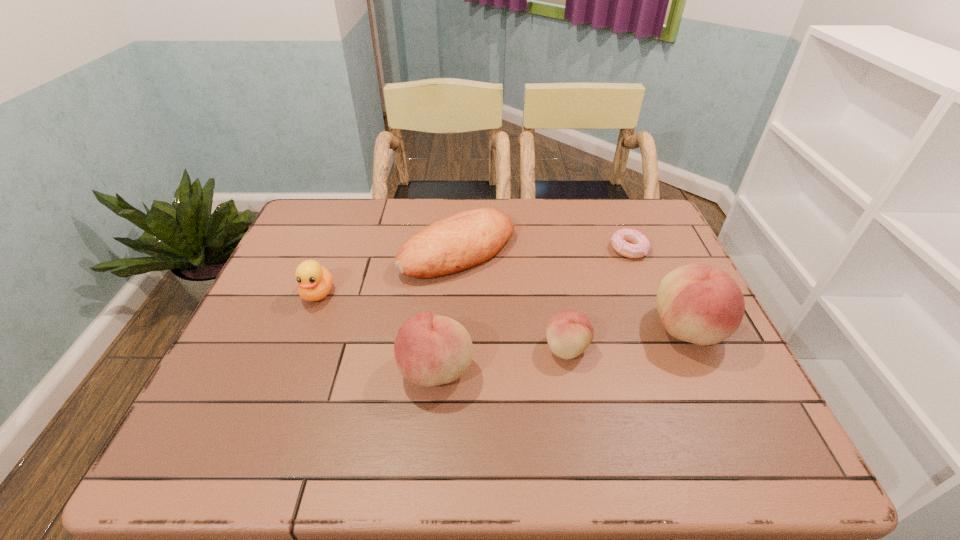
Find the location of `the second shortest peach`. the second shortest peach is located at coordinates (430, 350).

The height and width of the screenshot is (540, 960). In order to click on the fifth shortest object in this screenshot , I will do 430,350.

Find the location of a particular element. This screenshot has height=540, width=960. the shortest peach is located at coordinates (569, 332).

Find the location of a particular element. the second peach from right to left is located at coordinates (569, 332).

I want to click on the rightmost peach, so click(701, 304).

This screenshot has height=540, width=960. I want to click on bread, so click(463, 240).

Locate an element on the screen. Image resolution: width=960 pixels, height=540 pixels. doughnut is located at coordinates (630, 243).

Where is `duckling`? The width and height of the screenshot is (960, 540). duckling is located at coordinates [x=315, y=281].

In order to click on free space located on the back of the second tallest object in this screenshot , I will do `click(442, 302)`.

Locate an element on the screen. free space located on the left of the second peach from left to right is located at coordinates (x=381, y=348).